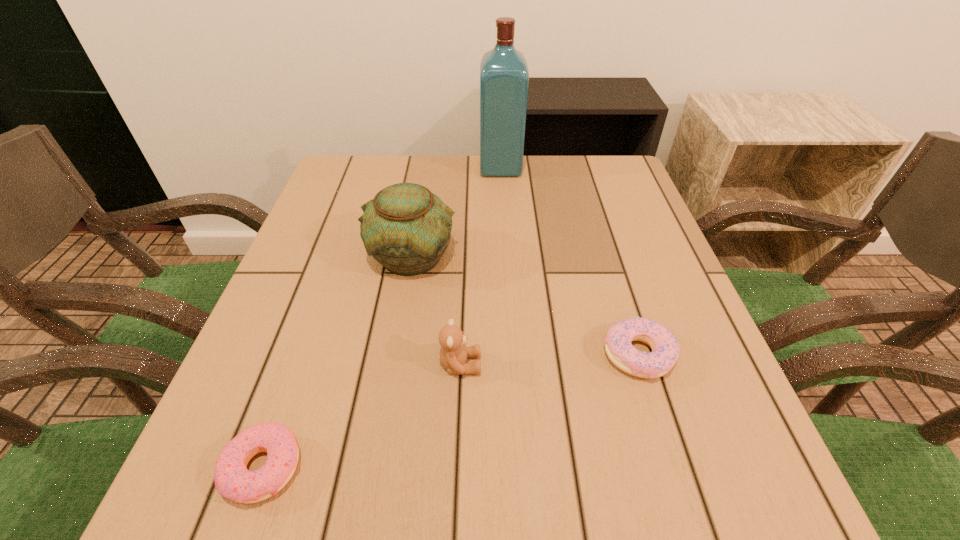
Locate an element on the screen. free space that satisfies the following two spatial constraints: 1. on the front side of the farther doughnut; 2. on the right side of the second farthest object is located at coordinates (396, 355).

This screenshot has width=960, height=540. I want to click on vacant space that satisfies the following two spatial constraints: 1. on the flat label side of the farthest object; 2. on the front side of the fourth shortest object, so click(506, 256).